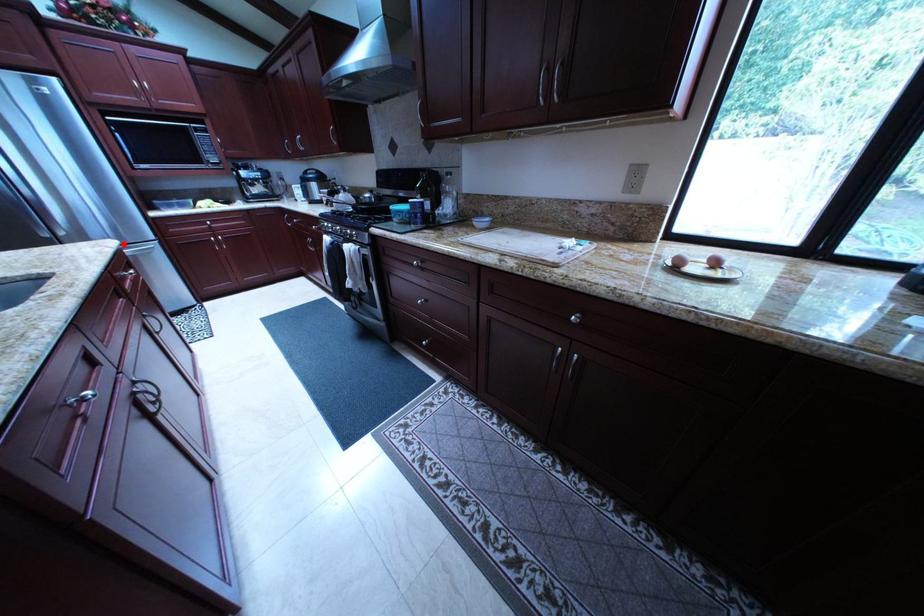
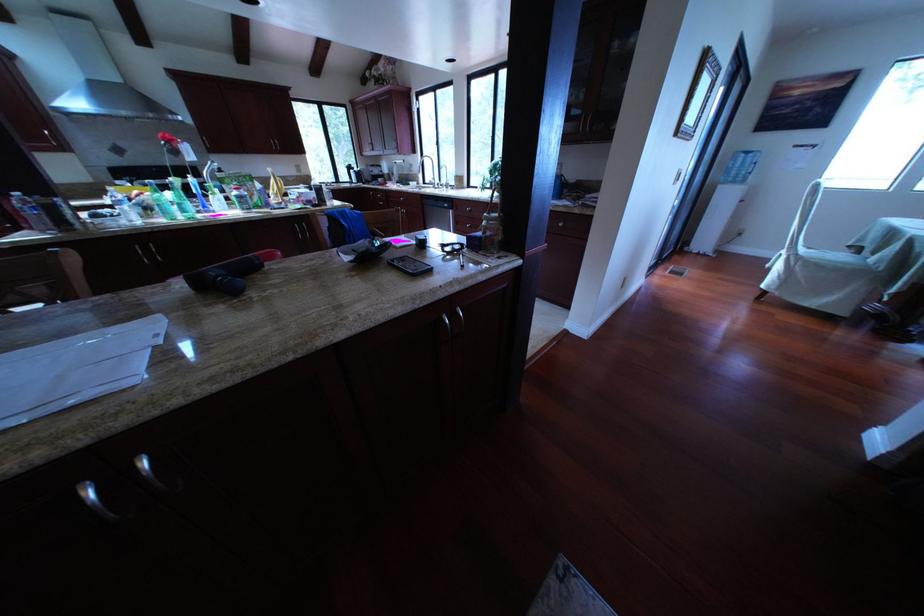
Question: I am providing you with two images of the same scene from different viewpoints. A red point is marked on the first image. Can you still see the location of the red point in image 2?

Choices:
 (A) Yes
 (B) No

Answer: (B)